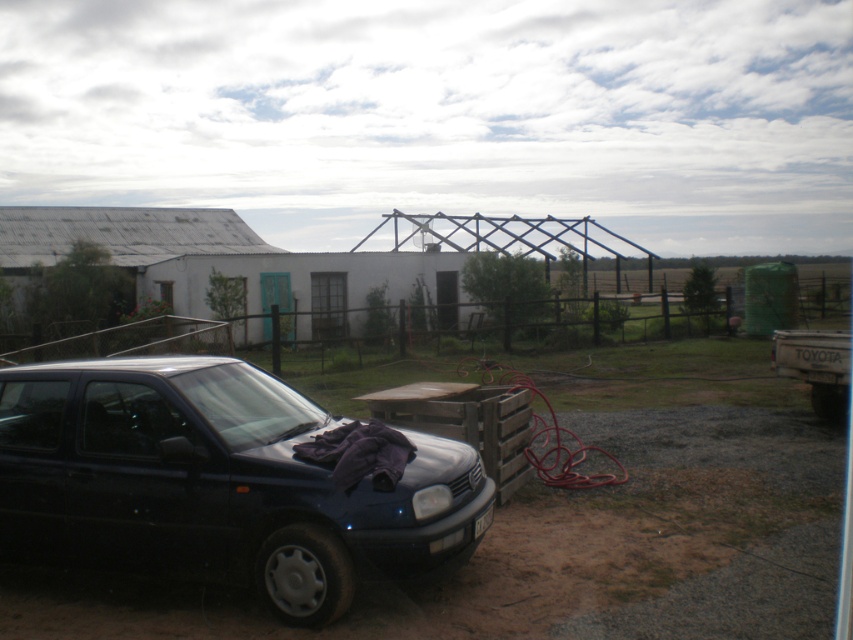
Describe the element at coordinates (218, 481) in the screenshot. The height and width of the screenshot is (640, 853). I see `shiny black car at lower left` at that location.

Does shiny black car at lower left appear over black plastic license plate at lower center?

Correct, shiny black car at lower left is located above black plastic license plate at lower center.

Locate an element on the screen. This screenshot has width=853, height=640. shiny black car at lower left is located at coordinates (218, 481).

Where is `shiny black car at lower left`? This screenshot has width=853, height=640. shiny black car at lower left is located at coordinates (218, 481).

Does point (564, 576) lie in front of point (271, 524)?

No, it is not.

Between point (337, 621) and point (190, 394), which one is positioned in front?

Positioned in front is point (337, 621).

I want to click on black matte car at lower left, so click(x=582, y=522).

Does black matte car at lower left have a lesser width compared to black plastic license plate at lower center?

No.

Is point (802, 408) in front of point (480, 531)?

No, (802, 408) is further to viewer.

Identify the location of black matte car at lower left. (582, 522).